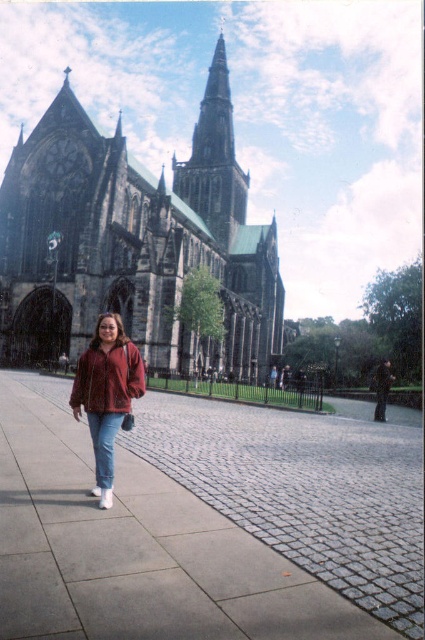
Between dark gray stone church at center and blue denim jeans at lower left, which one is positioned lower?

blue denim jeans at lower left

Is dark gray stone church at center taller than blue denim jeans at lower left?

Indeed, dark gray stone church at center has a greater height compared to blue denim jeans at lower left.

Between point (275, 310) and point (107, 424), which one is positioned behind?

Positioned behind is point (275, 310).

Identify the location of dark gray stone church at center. This screenshot has height=640, width=425. (133, 243).

Does matte red jacket at center have a smaller size compared to blue denim jeans at lower left?

Actually, matte red jacket at center might be larger than blue denim jeans at lower left.

Who is more forward, (95, 465) or (104, 476)?

Positioned in front is point (104, 476).

Where is `matte red jacket at center`? matte red jacket at center is located at coordinates (107, 394).

In the scene shown: Does dark gray stone spire at center have a greater width compared to velvet maroon sweatshirt at center?

Correct, the width of dark gray stone spire at center exceeds that of velvet maroon sweatshirt at center.

Can you confirm if dark gray stone spire at center is positioned to the left of velvet maroon sweatshirt at center?

In fact, dark gray stone spire at center is to the right of velvet maroon sweatshirt at center.

Is point (204, 104) in front of point (101, 349)?

No, (204, 104) is behind (101, 349).

What are the coordinates of `dark gray stone spire at center` in the screenshot? It's located at (214, 157).